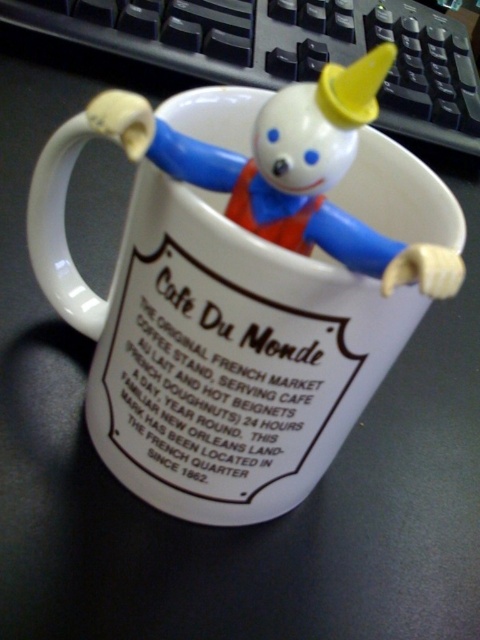
Does point (315, 273) come closer to viewer compared to point (393, 19)?

Yes.

Image resolution: width=480 pixels, height=640 pixels. I want to click on white ceramic mug at center, so click(x=213, y=342).

Locate an element on the screen. white ceramic mug at center is located at coordinates (213, 342).

Can you confirm if black plastic keyboard at upper center is smaller than plastic toy at upper center?

No.

Is black plastic keyboard at upper center below plastic toy at upper center?

Incorrect, black plastic keyboard at upper center is not positioned below plastic toy at upper center.

Locate an element on the screen. Image resolution: width=480 pixels, height=640 pixels. black plastic keyboard at upper center is located at coordinates (287, 49).

Is white ceramic mug at center below plastic toy at upper center?

Yes, white ceramic mug at center is below plastic toy at upper center.

Who is more forward, (279,432) or (254,161)?

Positioned in front is point (254,161).

I want to click on white ceramic mug at center, so [213, 342].